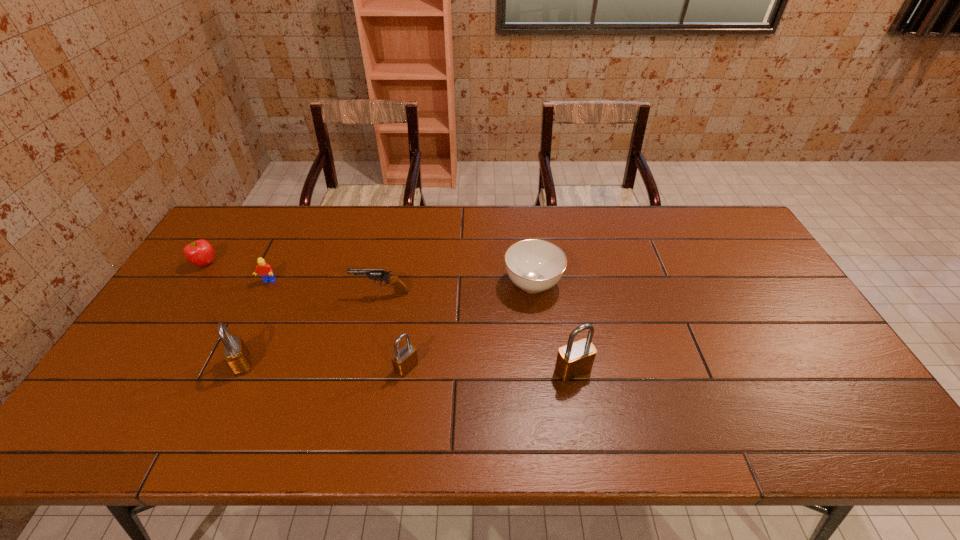
The image size is (960, 540). Identify the location of free location that satisfies the following two spatial constraints: 1. along the barrel of the gun; 2. on the front-facing side of the Lego. (383, 282).

In order to click on vacant space that satisfies the following two spatial constraints: 1. on the front side of the second tallest object; 2. on the left side of the second padlock from left to right in this screenshot , I will do `click(241, 367)`.

Where is `free location that satisfies the following two spatial constraints: 1. on the front-facing side of the shortest padlock; 2. on the right side of the Lego`? Image resolution: width=960 pixels, height=540 pixels. free location that satisfies the following two spatial constraints: 1. on the front-facing side of the shortest padlock; 2. on the right side of the Lego is located at coordinates (227, 367).

Image resolution: width=960 pixels, height=540 pixels. In order to click on blank area in the image that satisfies the following two spatial constraints: 1. on the front side of the shortest padlock; 2. on the right side of the apple in this screenshot , I will do `click(136, 367)`.